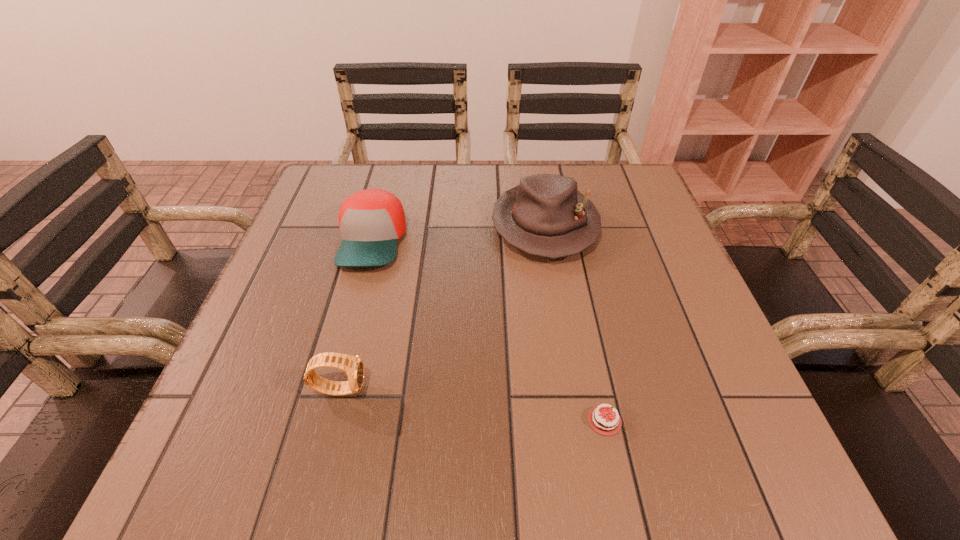
Where is `free space at the far left corner`? free space at the far left corner is located at coordinates (372, 165).

Locate an element on the screen. The width and height of the screenshot is (960, 540). free space at the far right corner of the desktop is located at coordinates click(604, 179).

Locate an element on the screen. The width and height of the screenshot is (960, 540). vacant space at the near right corner of the desktop is located at coordinates (744, 472).

Where is `free point between the chocolate cake and the watch`? Image resolution: width=960 pixels, height=540 pixels. free point between the chocolate cake and the watch is located at coordinates (472, 404).

I want to click on empty location between the shortest object and the watch, so click(x=472, y=404).

Locate an element on the screen. Image resolution: width=960 pixels, height=540 pixels. free space between the baseball cap and the chocolate cake is located at coordinates (489, 330).

Locate an element on the screen. blank region between the watch and the shortest object is located at coordinates (472, 404).

Image resolution: width=960 pixels, height=540 pixels. Identify the location of free point between the hat and the baseball cap. (459, 233).

The height and width of the screenshot is (540, 960). Find the location of `free space between the baseball cap and the watch`. free space between the baseball cap and the watch is located at coordinates (356, 314).

Identify the location of unoccupied position between the watch and the hat. (443, 307).